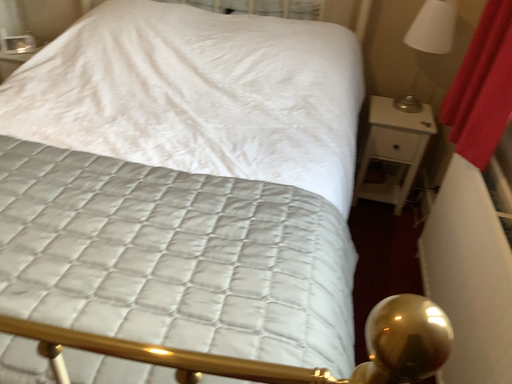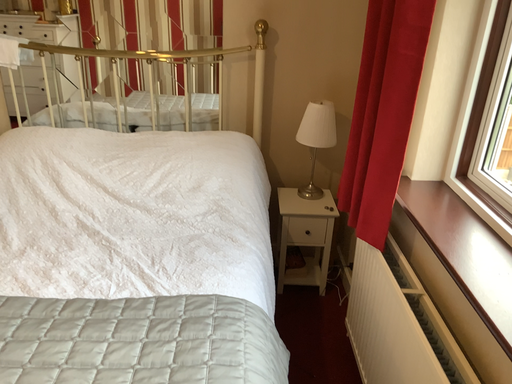
Question: How did the camera likely rotate when shooting the video?

Choices:
 (A) rotated downward
 (B) rotated upward

Answer: (B)